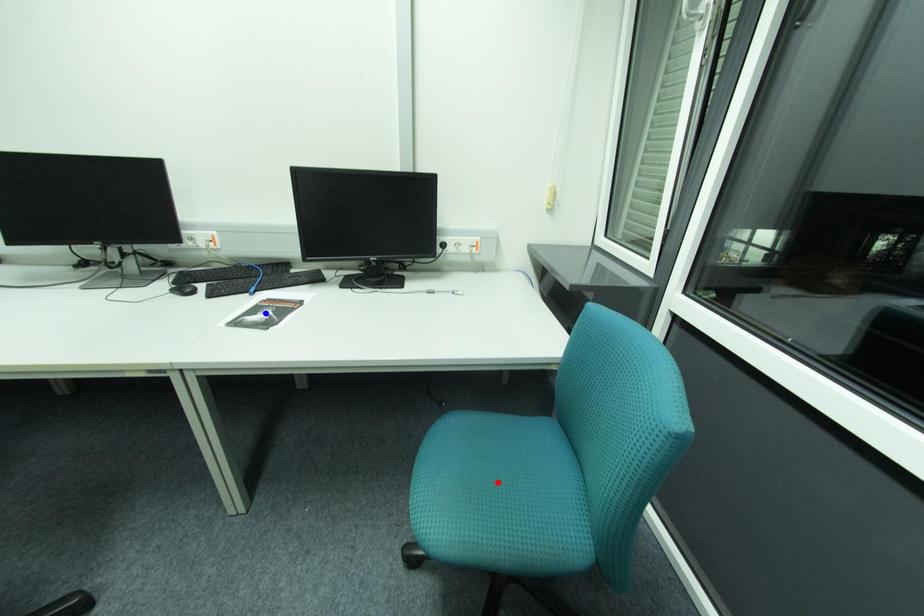
Question: Two points are marked on the image. Which point is closer to the camera?

Choices:
 (A) Blue point is closer.
 (B) Red point is closer.

Answer: (A)